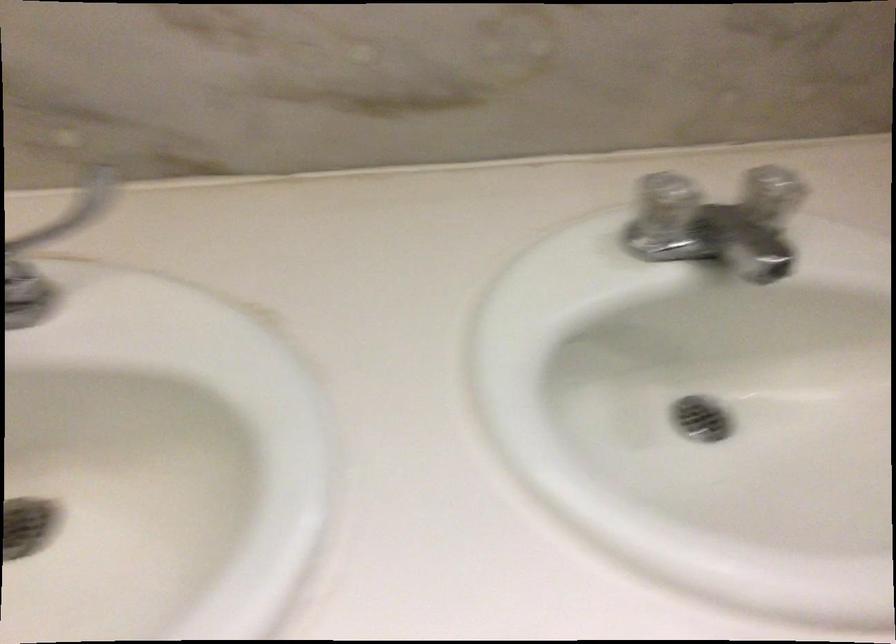
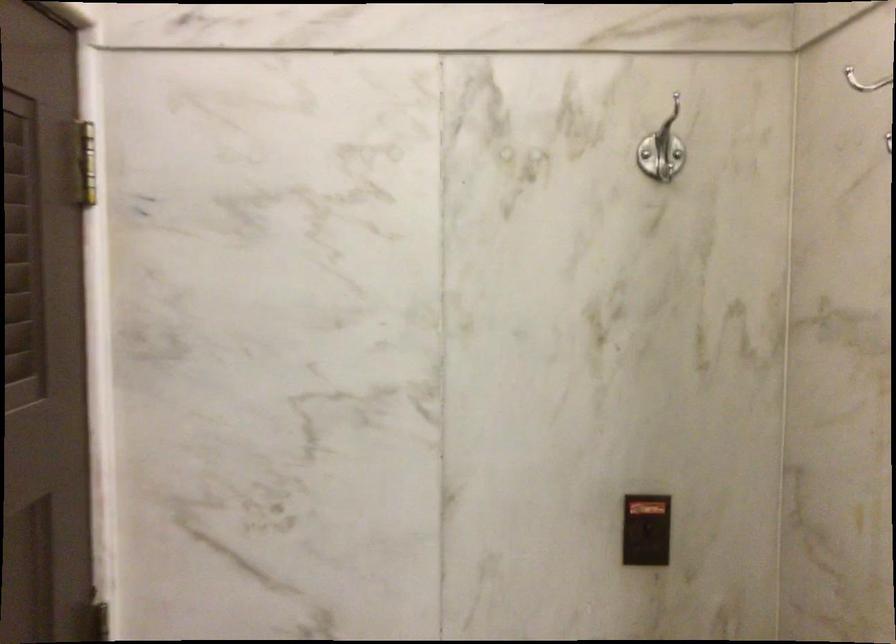
Question: The first image is from the beginning of the video and the second image is from the end. How did the camera likely rotate when shooting the video?

Choices:
 (A) Left
 (B) Right
 (C) Up
 (D) Down

Answer: (A)